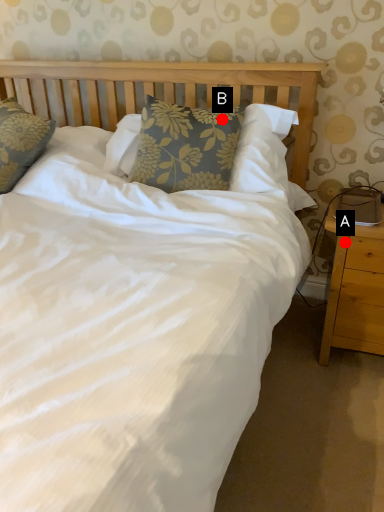
Question: Two points are circled on the image, labeled by A and B beside each circle. Among these points, which one is nearest to the camera?

Choices:
 (A) A is closer
 (B) B is closer

Answer: (A)